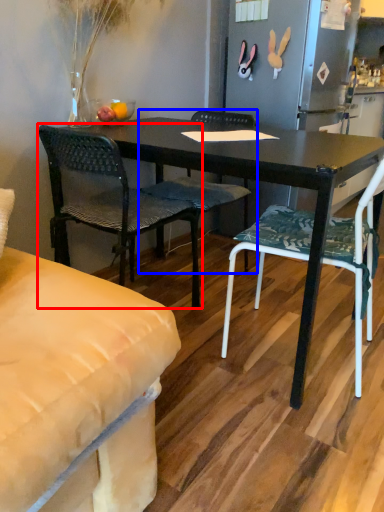
Question: Which object appears closest to the camera in this image, chair (highlighted by a red box) or chair (highlighted by a blue box)?

Choices:
 (A) chair
 (B) chair

Answer: (A)